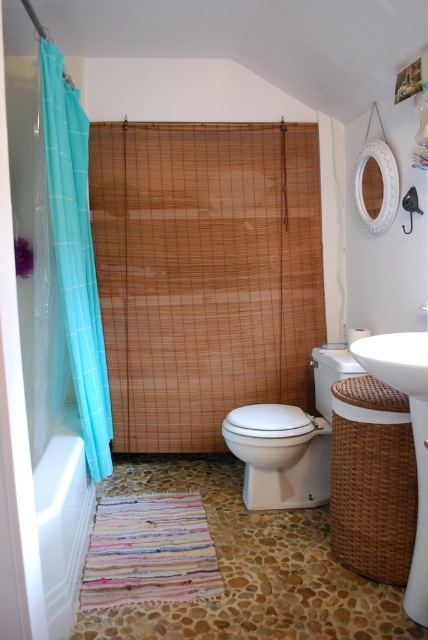
Who is more distant from viewer, (83, 554) or (424, 460)?

Point (83, 554)

Which is below, white glossy towel at lower left or white ceramic sink at right?

white glossy towel at lower left is lower down.

Does point (53, 593) lie behind point (421, 531)?

No.

Find the location of a particular element. white glossy towel at lower left is located at coordinates (62, 525).

Can you confirm if transparent plastic screen door at left is positioned to the right of white glossy toilet at center?

In fact, transparent plastic screen door at left is to the left of white glossy toilet at center.

Looking at this image, measure the distance between transparent plastic screen door at left and camera.

transparent plastic screen door at left and camera are 4.04 feet apart.

Where is `transparent plastic screen door at left`? transparent plastic screen door at left is located at coordinates (14, 438).

Is point (253, 317) positioned behind point (425, 520)?

Yes, it is.

Is bamboo curtain at center to the right of white ceramic sink at right from the viewer's perspective?

In fact, bamboo curtain at center is to the left of white ceramic sink at right.

Which is behind, point (137, 298) or point (398, 360)?

The point (137, 298) is behind.

Identify the location of bamboo curtain at center. This screenshot has width=428, height=640. (205, 273).